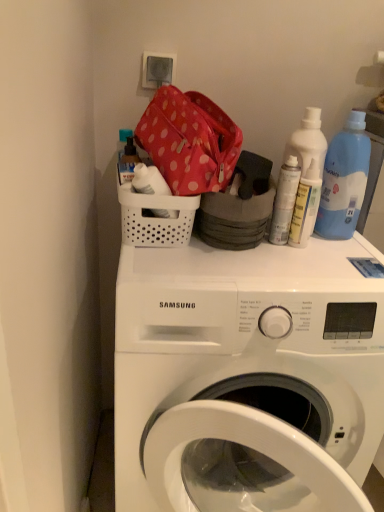
Describe the element at coordinates (189, 141) in the screenshot. I see `polka dot fabric bag at upper center` at that location.

Describe the element at coordinates (344, 180) in the screenshot. This screenshot has height=512, width=384. I see `blue plastic bottle at upper right` at that location.

The image size is (384, 512). Find the location of `translucent plastic spray can at upper right, the 1th bottle positioned from the right`. translucent plastic spray can at upper right, the 1th bottle positioned from the right is located at coordinates (305, 206).

From the picture: In order to face translucent plastic spray can at upper right, the 1th bottle positioned from the right, should I rotate leftwards or rightwards?

You should look right and rotate roughly 14.825 degrees.

Measure the distance between white plastic basket at upper center and camera.

white plastic basket at upper center and camera are 33.62 inches apart.

Where is `white plastic basket at upper center`? The image size is (384, 512). white plastic basket at upper center is located at coordinates (155, 218).

What do you see at coordinates (127, 161) in the screenshot? This screenshot has height=512, width=384. I see `translucent plastic soap dispenser at upper left, the 3th bottle when ordered from right to left` at bounding box center [127, 161].

The image size is (384, 512). What do you see at coordinates (284, 201) in the screenshot?
I see `white matte spray can at upper right, placed as the second bottle when sorted from right to left` at bounding box center [284, 201].

I want to click on white plastic washing machine at upper center, so click(x=248, y=376).

Which is in front, point (166, 346) or point (290, 205)?

The point (166, 346) is more forward.

How much distance is there between white plastic washing machine at upper center and white matte spray can at upper right, the second bottle positioned from the left?

white plastic washing machine at upper center and white matte spray can at upper right, the second bottle positioned from the left, are 14.06 inches apart.

Can you confirm if white plastic washing machine at upper center is taller than white matte spray can at upper right, placed as the second bottle when sorted from right to left?

Indeed, white plastic washing machine at upper center has a greater height compared to white matte spray can at upper right, placed as the second bottle when sorted from right to left.

Which of these two, white plastic washing machine at upper center or white matte spray can at upper right, placed as the second bottle when sorted from right to left, is bigger?

Bigger between the two is white plastic washing machine at upper center.

From a real-world perspective, which is physically above, white plastic basket at upper center or white plastic washing machine at upper center?

In real-world perspective, white plastic basket at upper center is above.

Which is behind, point (169, 201) or point (125, 249)?

The point (125, 249) is farther.

How many degrees apart are the facing directions of white plastic basket at upper center and white plastic washing machine at upper center?

They differ by 9.02e-05 degrees in their facing directions.

In the image, is white plastic basket at upper center positioned in front of or behind white plastic washing machine at upper center?

In the image, white plastic basket at upper center appears behind white plastic washing machine at upper center.

Does point (302, 199) come closer to viewer compared to point (369, 152)?

Yes, it is.

At what (x,y) coordinates should I click in order to perform the action: click on cleaning product above the translucent plastic spray can at upper right, the third bottle positioned from the left (from the image's perspective). Please return your answer as a coordinate pair (x, y). Looking at the image, I should click on (344, 180).

Is translucent plastic spray can at upper right, the 1th bottle positioned from the right, smaller than blue plastic bottle at upper right?

Indeed, translucent plastic spray can at upper right, the 1th bottle positioned from the right, has a smaller size compared to blue plastic bottle at upper right.

Which object is positioned more to the right, white matte spray can at upper right, the second bottle positioned from the left, or white plastic basket at upper center?

From the viewer's perspective, white matte spray can at upper right, the second bottle positioned from the left, appears more on the right side.

Based on the photo, is white matte spray can at upper right, the second bottle positioned from the left, located outside white plastic basket at upper center?

Yes.

Considering the relative sizes of white matte spray can at upper right, the second bottle positioned from the left, and white plastic basket at upper center in the image provided, is white matte spray can at upper right, the second bottle positioned from the left, wider than white plastic basket at upper center?

No.

Which of these two, white matte spray can at upper right, placed as the second bottle when sorted from right to left, or white plastic basket at upper center, is smaller?

white matte spray can at upper right, placed as the second bottle when sorted from right to left.

Between translucent plastic soap dispenser at upper left, arranged as the first bottle when viewed from the left, and white plastic washing machine at upper center, which one has less height?

Standing shorter between the two is translucent plastic soap dispenser at upper left, arranged as the first bottle when viewed from the left.

Is translucent plastic soap dispenser at upper left, arranged as the first bottle when viewed from the left, looking in the opposite direction of white plastic washing machine at upper center?

No, translucent plastic soap dispenser at upper left, arranged as the first bottle when viewed from the left, is not facing away from white plastic washing machine at upper center.

Where is `bottle on the left of white plastic washing machine at upper center`? The image size is (384, 512). bottle on the left of white plastic washing machine at upper center is located at coordinates coord(127,161).

Considering the relative positions of translucent plastic soap dispenser at upper left, arranged as the first bottle when viewed from the left, and white plastic washing machine at upper center in the image provided, is translucent plastic soap dispenser at upper left, arranged as the first bottle when viewed from the left, in front of white plastic washing machine at upper center?

No, it is behind white plastic washing machine at upper center.

Considering the positions of point (343, 173) and point (172, 191), is point (343, 173) closer or farther from the camera than point (172, 191)?

Point (343, 173) appears to be farther away from the viewer than point (172, 191).

Looking at the image, does blue plastic bottle at upper right seem bigger or smaller compared to polka dot fabric bag at upper center?

blue plastic bottle at upper right is smaller than polka dot fabric bag at upper center.

From a real-world perspective, is blue plastic bottle at upper right over polka dot fabric bag at upper center?

No, from a real-world perspective, blue plastic bottle at upper right is not on top of polka dot fabric bag at upper center.

How much distance is there between blue plastic bottle at upper right and polka dot fabric bag at upper center?

A distance of 12.83 inches exists between blue plastic bottle at upper right and polka dot fabric bag at upper center.

Is white plastic basket at upper center oriented towards polka dot fabric bag at upper center?

No, white plastic basket at upper center is not oriented towards polka dot fabric bag at upper center.

Can you confirm if white plastic basket at upper center is positioned to the left of polka dot fabric bag at upper center?

Indeed, white plastic basket at upper center is positioned on the left side of polka dot fabric bag at upper center.

Considering the relative sizes of white plastic basket at upper center and polka dot fabric bag at upper center in the image provided, is white plastic basket at upper center taller than polka dot fabric bag at upper center?

No, white plastic basket at upper center is not taller than polka dot fabric bag at upper center.

Is white plastic basket at upper center far from polka dot fabric bag at upper center?

white plastic basket at upper center is actually quite close to polka dot fabric bag at upper center.

You are a GUI agent. You are given a task and a screenshot of the screen. Output one action in this format:
    pyautogui.click(x=<x>, y=<y>)
    Task: Click on the 2nd bottle above the white plastic washing machine at upper center (from a real-world perspective)
    The height and width of the screenshot is (512, 384).
    Given the screenshot: What is the action you would take?
    pyautogui.click(x=284, y=201)

Locate an element on the screen. The height and width of the screenshot is (512, 384). washing machine that is in front of the white plastic basket at upper center is located at coordinates (248, 376).

Based on their spatial positions, is blue plastic bottle at upper right or white matte spray can at upper right, the second bottle positioned from the left, further from white plastic basket at upper center?

Among the two, blue plastic bottle at upper right is located further to white plastic basket at upper center.

Based on their spatial positions, is blue plastic bottle at upper right or white matte spray can at upper right, placed as the second bottle when sorted from right to left, further from white plastic washing machine at upper center?

The object further to white plastic washing machine at upper center is blue plastic bottle at upper right.

From the image, which object appears to be farther from polka dot fabric bag at upper center, white plastic basket at upper center or blue plastic bottle at upper right?

blue plastic bottle at upper right is further to polka dot fabric bag at upper center.

Looking at the image, which one is located closer to translucent plastic soap dispenser at upper left, the 3th bottle when ordered from right to left, polka dot fabric bag at upper center or white plastic washing machine at upper center?

The object closer to translucent plastic soap dispenser at upper left, the 3th bottle when ordered from right to left, is polka dot fabric bag at upper center.

Based on their spatial positions, is white plastic washing machine at upper center or translucent plastic soap dispenser at upper left, arranged as the first bottle when viewed from the left, closer to blue plastic bottle at upper right?

Based on the image, white plastic washing machine at upper center appears to be nearer to blue plastic bottle at upper right.

When comparing their distances from polka dot fabric bag at upper center, does blue plastic bottle at upper right or white plastic basket at upper center seem further?

Based on the image, blue plastic bottle at upper right appears to be further to polka dot fabric bag at upper center.

When comparing their distances from translucent plastic spray can at upper right, the third bottle positioned from the left, does polka dot fabric bag at upper center or white plastic basket at upper center seem closer?

Based on the image, polka dot fabric bag at upper center appears to be nearer to translucent plastic spray can at upper right, the third bottle positioned from the left.

Estimate the real-world distances between objects in this image. Which object is further from white matte spray can at upper right, placed as the second bottle when sorted from right to left, white plastic basket at upper center or translucent plastic spray can at upper right, the 1th bottle positioned from the right?

white plastic basket at upper center is further to white matte spray can at upper right, placed as the second bottle when sorted from right to left.

Image resolution: width=384 pixels, height=512 pixels. Identify the location of bottle between white matte spray can at upper right, placed as the second bottle when sorted from right to left, and white plastic washing machine at upper center vertically. (305, 206).

Locate an element on the screen. The width and height of the screenshot is (384, 512). basket that lies between blue plastic bottle at upper right and white plastic washing machine at upper center from top to bottom is located at coordinates coord(155,218).

Identify the location of bottle located between translucent plastic soap dispenser at upper left, the 3th bottle when ordered from right to left, and translucent plastic spray can at upper right, the 1th bottle positioned from the right, in the left-right direction. The image size is (384, 512). (284, 201).

Image resolution: width=384 pixels, height=512 pixels. What are the coordinates of `material situated between translucent plastic soap dispenser at upper left, arranged as the first bottle when viewed from the left, and white matte spray can at upper right, the second bottle positioned from the left, from left to right` in the screenshot? It's located at (189, 141).